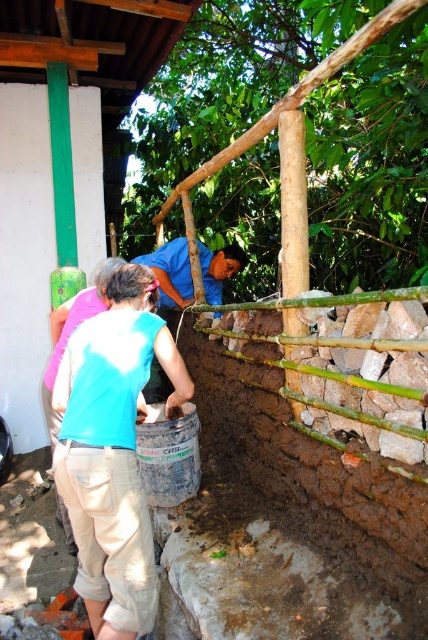
You are a construction worker observing the scene. There is a matte blue shirt at center and a khaki pants at lower left in your view. Which one is nearer to you?

The matte blue shirt at center is closer to the viewer than the khaki pants at lower left.